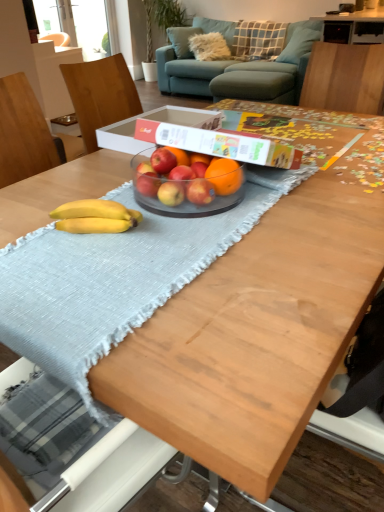
You are a GUI agent. You are given a task and a screenshot of the screen. Output one action in this format:
    pyautogui.click(x=<x>, y=<y>)
    Task: Click on the vacant region to the left of red matte apple at center, acting as the 5th apple starting from the right
    
    Given the screenshot: What is the action you would take?
    pyautogui.click(x=109, y=198)